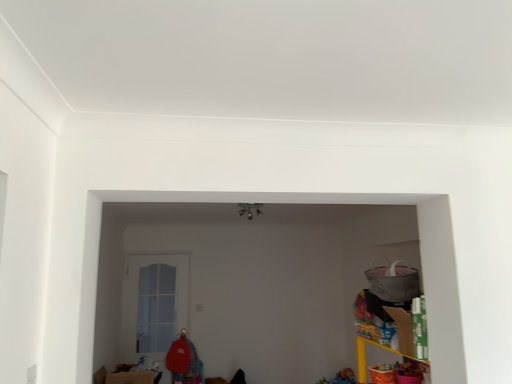
Find the location of a particular element. Image resolution: width=512 pixels, height=384 pixels. yellow plastic shelf at right is located at coordinates (364, 357).

Measure the distance between point (410, 335) and camera.

A distance of 2.53 meters exists between point (410, 335) and camera.

What do you see at coordinates (364, 357) in the screenshot? This screenshot has height=384, width=512. I see `yellow plastic shelf at right` at bounding box center [364, 357].

You are a GUI agent. You are given a task and a screenshot of the screen. Output one action in this format:
    pyautogui.click(x=<x>, y=<y>)
    Task: Click on the yellow plastic shelf at right
    The width and height of the screenshot is (512, 384).
    Given the screenshot: What is the action you would take?
    pyautogui.click(x=364, y=357)